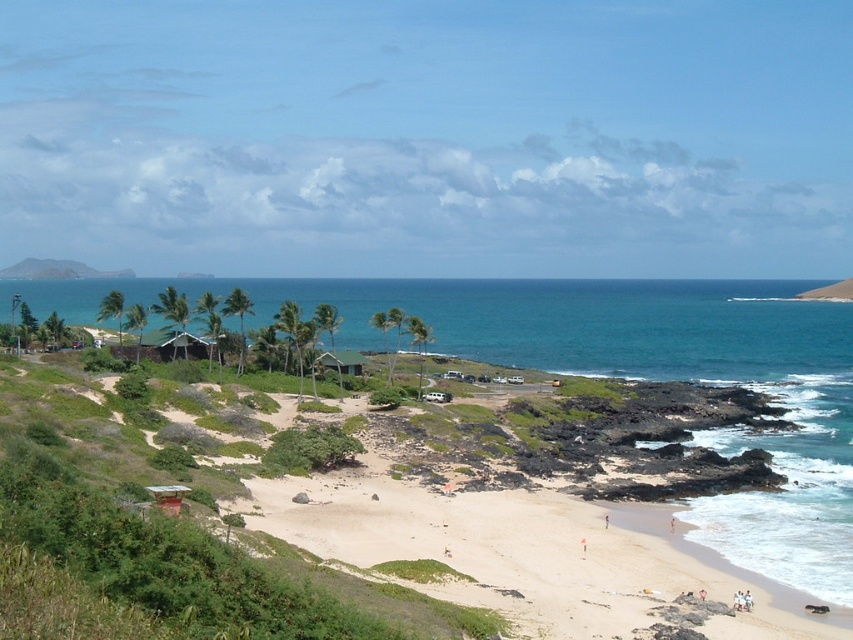
Question: Can you confirm if blue water at center is bigger than green matte hut at center?

Choices:
 (A) yes
 (B) no

Answer: (A)

Question: Which point is closer to the camera?

Choices:
 (A) pyautogui.click(x=325, y=358)
 (B) pyautogui.click(x=488, y=339)

Answer: (A)

Question: Is blue water at center bigger than green matte hut at center?

Choices:
 (A) no
 (B) yes

Answer: (B)

Question: Which point is farther to the camera?

Choices:
 (A) blue water at center
 (B) green matte hut at center

Answer: (B)

Question: Among these points, which one is nearest to the camera?

Choices:
 (A) (343, 349)
 (B) (659, 301)

Answer: (A)

Question: Can you confirm if blue water at center is positioned above green matte hut at center?

Choices:
 (A) yes
 (B) no

Answer: (A)